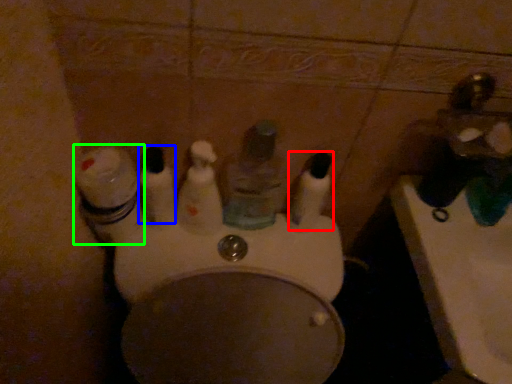
Question: Which object is positioned closest to mouthwash (highlighted by a red box)? Select from mouthwash (highlighted by a blue box) and toiletry (highlighted by a green box).

Choices:
 (A) mouthwash
 (B) toiletry

Answer: (A)